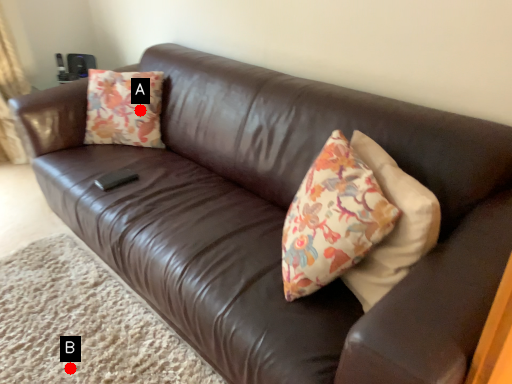
Question: Two points are circled on the image, labeled by A and B beside each circle. Among these points, which one is farthest from the camera?

Choices:
 (A) A is further
 (B) B is further

Answer: (A)